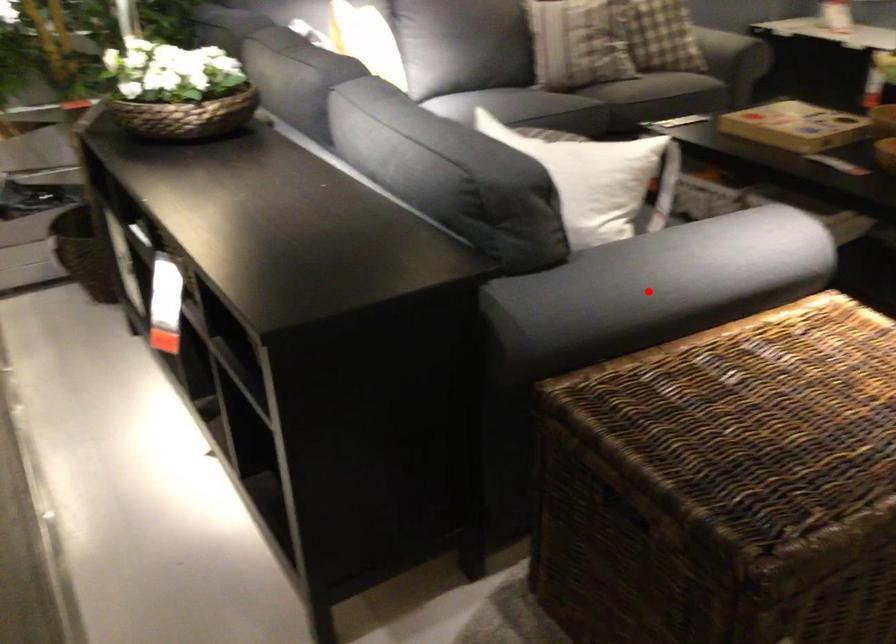
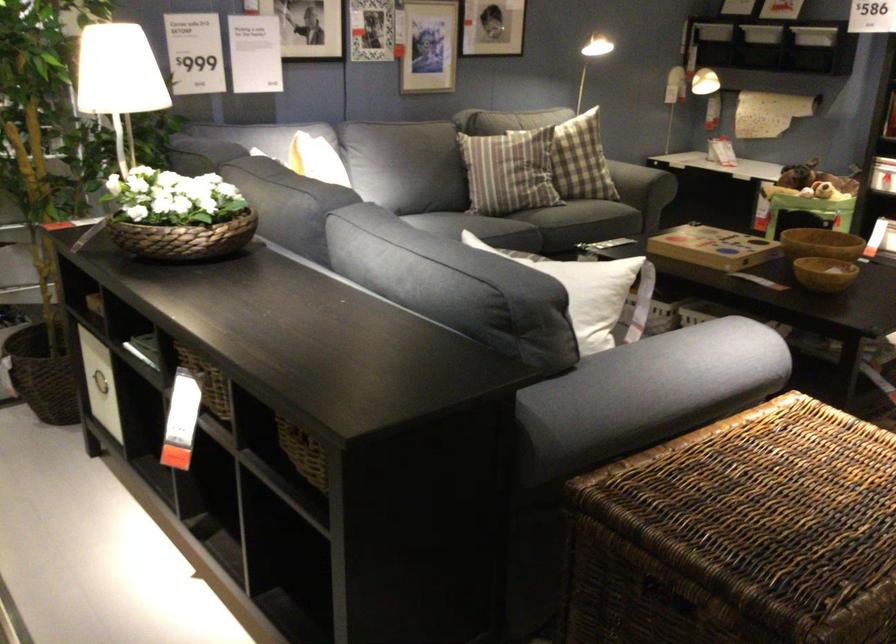
In the second image, find the point that corresponds to the highlighted location in the first image.

(647, 393)